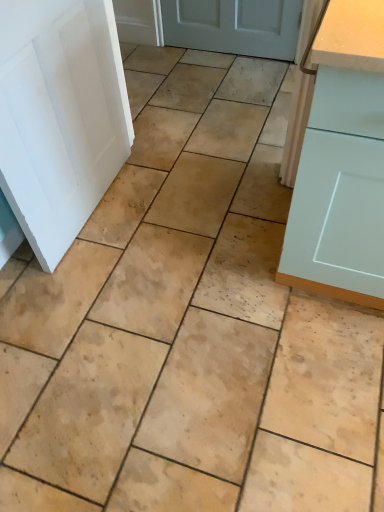
Find the location of `vacant region to the right of white matte door at left`. vacant region to the right of white matte door at left is located at coordinates (172, 207).